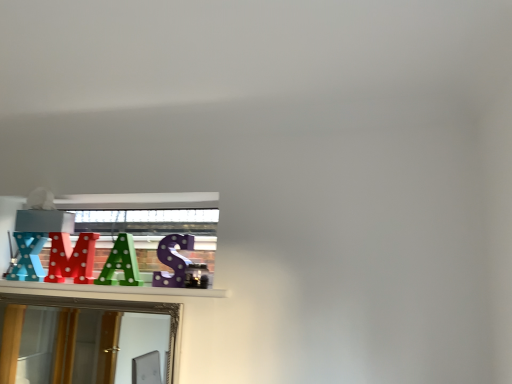
Find the location of a particular element. free space above gold-framed mirror at lower left (from a real-world perspective) is located at coordinates (88, 297).